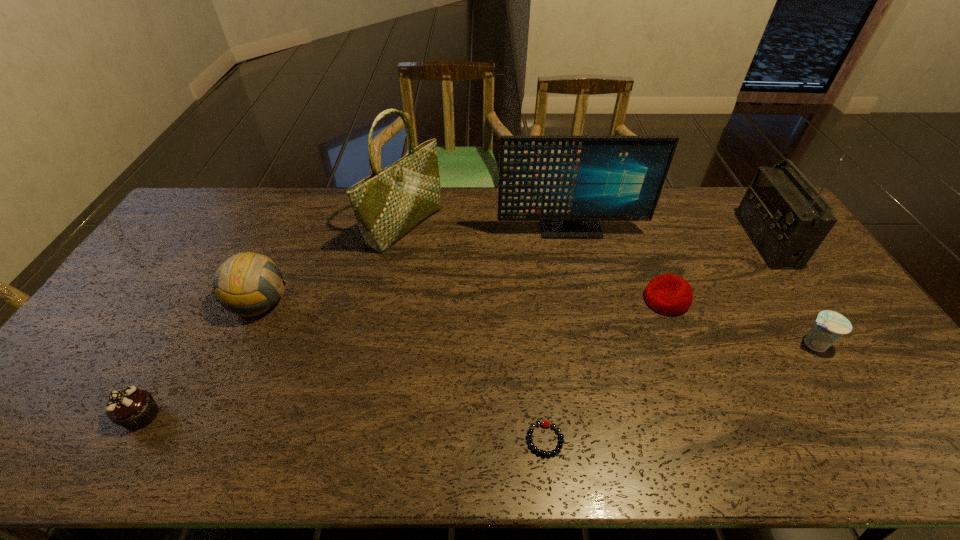
The height and width of the screenshot is (540, 960). I want to click on shopping bag, so click(389, 203).

At what (x,y) coordinates should I click in order to perform the action: click on radio receiver. Please return your answer as a coordinate pair (x, y). The height and width of the screenshot is (540, 960). Looking at the image, I should click on (786, 222).

Locate an element on the screen. computer monitor is located at coordinates (569, 183).

This screenshot has height=540, width=960. Identify the location of the fifth shortest object. (247, 284).

You are a GUI agent. You are given a task and a screenshot of the screen. Output one action in this format:
    pyautogui.click(x=<x>, y=<y>)
    Task: Click on the volleyball
    This screenshot has height=540, width=960.
    Given the screenshot: What is the action you would take?
    pyautogui.click(x=247, y=284)

This screenshot has height=540, width=960. I want to click on the third nearest object, so click(x=830, y=326).

At what (x,y) coordinates should I click in order to perform the action: click on cupcake. Please return your answer as a coordinate pair (x, y). Image resolution: width=960 pixels, height=540 pixels. Looking at the image, I should click on (132, 408).

This screenshot has width=960, height=540. I want to click on the seventh tallest object, so click(669, 294).

Identify the location of bracelet. This screenshot has height=540, width=960. (544, 423).

Identify the location of free space located on the front of the shopping bag. This screenshot has width=960, height=540. (393, 290).